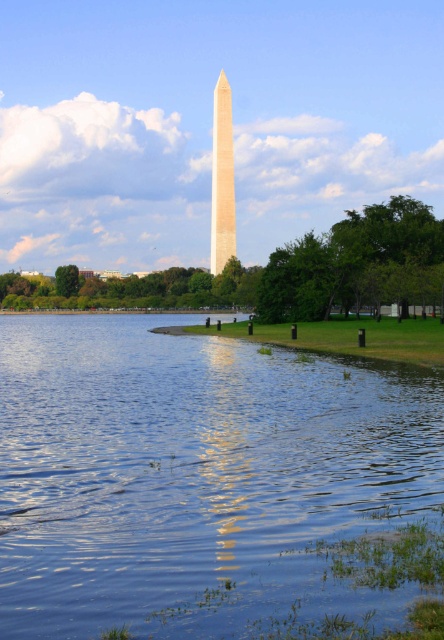
Can you confirm if blue glassy water at center is smaller than beige stone obelisk at center?

Yes.

Can you confirm if blue glassy water at center is wider than beige stone obelisk at center?

Indeed, blue glassy water at center has a greater width compared to beige stone obelisk at center.

From the picture: Measure the distance between point (x=261, y=378) and camera.

29.02 meters

Where is `blue glassy water at center`? The image size is (444, 640). blue glassy water at center is located at coordinates (198, 477).